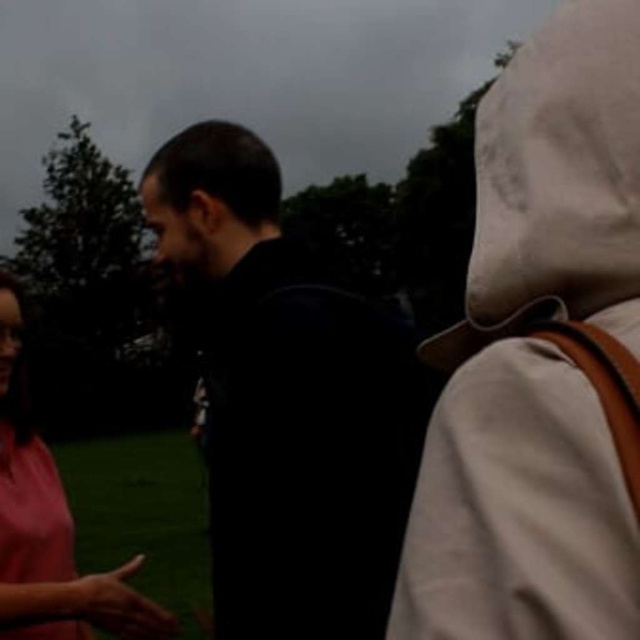
Question: Is black matte jacket at center smaller than pink matte shirt at left?

Choices:
 (A) no
 (B) yes

Answer: (B)

Question: From the image, what is the correct spatial relationship of black matte jacket at center in relation to pink matte shirt at left?

Choices:
 (A) left
 (B) right

Answer: (B)

Question: Is black matte jacket at center positioned at the back of pink matte shirt at left?

Choices:
 (A) no
 (B) yes

Answer: (A)

Question: Which point is closer to the camera taking this photo?

Choices:
 (A) (3, 291)
 (B) (253, 237)

Answer: (B)